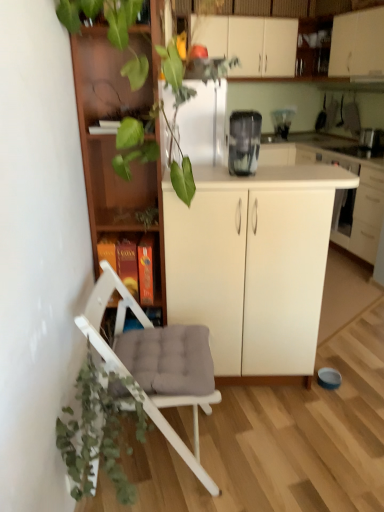
This screenshot has width=384, height=512. What do you see at coordinates (357, 44) in the screenshot? I see `white glossy cabinet at upper right, arranged as the second cabinetry when viewed from the left` at bounding box center [357, 44].

The image size is (384, 512). I want to click on transparent plastic blender at center, the first appliance ordered from the bottom, so click(244, 142).

The image size is (384, 512). What do you see at coordinates (282, 121) in the screenshot? I see `transparent plastic blender at upper center, which appears as the 2th appliance when viewed from the right` at bounding box center [282, 121].

The height and width of the screenshot is (512, 384). What do you see at coordinates (120, 115) in the screenshot? I see `green leafy plant at upper center` at bounding box center [120, 115].

The height and width of the screenshot is (512, 384). What are the coordinates of `white glossy cabinet at upper right, which is the third cabinetry in bottom-to-top order` in the screenshot? It's located at (357, 44).

From the picture: From a real-world perspective, which object rests below the other?

transparent plastic blender at center, the first appliance when ordered from front to back, from a real-world perspective.

Between white matte cabinet at upper center and transparent plastic blender at center, marked as the first appliance in a left-to-right arrangement, which one appears on the left side from the viewer's perspective?

From the viewer's perspective, transparent plastic blender at center, marked as the first appliance in a left-to-right arrangement, appears more on the left side.

Are white matte cabinet at upper center and transparent plastic blender at center, the third appliance when ordered from right to left, located far from each other?

Yes.

What's the angular difference between white matte cabinet at upper center and transparent plastic blender at center, the first appliance ordered from the bottom,'s facing directions?

There is a 76.2-degree angle between the facing directions of white matte cabinet at upper center and transparent plastic blender at center, the first appliance ordered from the bottom.

From the image's perspective, does transparent plastic blender at center, the first appliance when ordered from front to back, appear higher than white matte cabinet at upper center?

Incorrect, from the image's perspective, transparent plastic blender at center, the first appliance when ordered from front to back, is lower than white matte cabinet at upper center.

Is the depth of transparent plastic blender at center, the first appliance ordered from the bottom, greater than that of white matte cabinet at upper center?

No, transparent plastic blender at center, the first appliance ordered from the bottom, is closer to the camera.

Visually, is transparent plastic blender at center, the third appliance when ordered from right to left, positioned to the left or to the right of white matte cabinet at upper center?

transparent plastic blender at center, the third appliance when ordered from right to left, is positioned on white matte cabinet at upper center's left side.

Is wooden bookshelf at left not inside green matte plant at lower left?

That's correct, wooden bookshelf at left is outside of green matte plant at lower left.

Could you tell me if wooden bookshelf at left is turned towards green matte plant at lower left?

Yes, wooden bookshelf at left is aimed at green matte plant at lower left.

From the image's perspective, between wooden bookshelf at left and green matte plant at lower left, which one is located above?

wooden bookshelf at left is shown above in the image.

Does point (117, 294) appear closer or farther from the camera than point (77, 426)?

Point (117, 294) appears to be farther away from the viewer than point (77, 426).

Is transparent plastic blender at upper center, which appears as the 2th appliance when viewed from the left, wider or thinner than green leafy plant at upper center?

In the image, transparent plastic blender at upper center, which appears as the 2th appliance when viewed from the left, appears to be more narrow than green leafy plant at upper center.

Is point (277, 126) closer to camera compared to point (126, 133)?

That is False.

Is green leafy plant at upper center directly adjacent to white matte cabinet at center, the 3th cabinetry viewed from the top?

No, green leafy plant at upper center is not in contact with white matte cabinet at center, the 3th cabinetry viewed from the top.

Which point is more forward, (138, 192) or (242, 259)?

The point (242, 259) is more forward.

Does green leafy plant at upper center have a smaller size compared to white matte cabinet at center, the 1th cabinetry in the left-to-right sequence?

Yes.

In the scene shown: In terms of width, does green leafy plant at upper center look wider or thinner when compared to white matte cabinet at center, which is the first cabinetry from bottom to top?

In the image, green leafy plant at upper center appears to be wider than white matte cabinet at center, which is the first cabinetry from bottom to top.

From the image's perspective, is white glossy cabinet at upper right, which is the 1th cabinetry in top-to-bottom order, above or below white matte cabinet at center, the 3th cabinetry viewed from the top?

From the image's perspective, white glossy cabinet at upper right, which is the 1th cabinetry in top-to-bottom order, appears above white matte cabinet at center, the 3th cabinetry viewed from the top.

Considering the sizes of white glossy cabinet at upper right, arranged as the second cabinetry when viewed from the left, and white matte cabinet at center, the 3th cabinetry viewed from the top, in the image, is white glossy cabinet at upper right, arranged as the second cabinetry when viewed from the left, taller or shorter than white matte cabinet at center, the 3th cabinetry viewed from the top,?

Clearly, white glossy cabinet at upper right, arranged as the second cabinetry when viewed from the left, is shorter compared to white matte cabinet at center, the 3th cabinetry viewed from the top.

Which object is closer to the camera, white glossy cabinet at upper right, which appears as the 2th cabinetry when viewed from the right, or white matte cabinet at center, the 3th cabinetry when ordered from right to left?

Positioned in front is white matte cabinet at center, the 3th cabinetry when ordered from right to left.

Is white glossy cabinet at upper right, which appears as the 2th cabinetry when viewed from the right, positioned with its back to white matte cabinet at center, the 1th cabinetry in the left-to-right sequence?

No, white glossy cabinet at upper right, which appears as the 2th cabinetry when viewed from the right, is not facing the opposite direction of white matte cabinet at center, the 1th cabinetry in the left-to-right sequence.

In the scene shown: From the image's perspective, is white matte cabinet at upper center beneath white matte cabinet at center, marked as the second cabinetry in a top-to-bottom arrangement?

Actually, white matte cabinet at upper center appears above white matte cabinet at center, marked as the second cabinetry in a top-to-bottom arrangement, in the image.

Is white matte cabinet at upper center touching white matte cabinet at center, which is the second cabinetry in bottom-to-top order?

No, white matte cabinet at upper center is not in contact with white matte cabinet at center, which is the second cabinetry in bottom-to-top order.

From a real-world perspective, between white matte cabinet at upper center and white matte cabinet at center, the 1th cabinetry when ordered from right to left, who is vertically higher?

white matte cabinet at upper center, from a real-world perspective.

Considering the positions of objects white matte cabinet at upper center and white matte cabinet at center, marked as the second cabinetry in a top-to-bottom arrangement, in the image provided, who is in front, white matte cabinet at upper center or white matte cabinet at center, marked as the second cabinetry in a top-to-bottom arrangement,?

white matte cabinet at center, marked as the second cabinetry in a top-to-bottom arrangement, is closer to the camera.

In order to click on dresser behind the transparent plastic blender at center, the third appliance when ordered from right to left in this screenshot , I will do `click(261, 34)`.

This screenshot has height=512, width=384. In order to click on appliance on the left of the white matte cabinet at upper center in this screenshot , I will do `click(244, 142)`.

From the image, which object appears to be farther from transparent plastic blender at center, which is counted as the third appliance, starting from the top, wooden bookshelf at left or transparent plastic blender at upper center, which appears as the 2th appliance when viewed from the left?

transparent plastic blender at upper center, which appears as the 2th appliance when viewed from the left, lies further to transparent plastic blender at center, which is counted as the third appliance, starting from the top, than the other object.

From the picture: From the image, which object appears to be nearer to metallic silver toaster at upper right, the 2th appliance when ordered from back to front, green leafy plant at upper center or green matte plant at lower left?

Based on the image, green leafy plant at upper center appears to be nearer to metallic silver toaster at upper right, the 2th appliance when ordered from back to front.

Considering their positions, is transparent plastic blender at center, which is the third appliance from back to front, positioned further to green matte plant at lower left than white matte cabinet at upper center?

white matte cabinet at upper center is positioned further to the anchor green matte plant at lower left.

From the image, which object appears to be farther from green leafy plant at upper center, metallic silver toaster at upper right, positioned as the 2th appliance in front-to-back order, or transparent plastic blender at center, which is counted as the third appliance, starting from the top?

metallic silver toaster at upper right, positioned as the 2th appliance in front-to-back order, is positioned further to the anchor green leafy plant at upper center.

When comparing their distances from white glossy cabinet at upper right, which is the 1th cabinetry in top-to-bottom order, does green matte plant at lower left or white matte cabinet at upper center seem closer?

Among the two, white matte cabinet at upper center is located nearer to white glossy cabinet at upper right, which is the 1th cabinetry in top-to-bottom order.

When comparing their distances from white matte cabinet at upper center, does white glossy cabinet at upper right, which appears as the 2th cabinetry when viewed from the right, or wooden bookshelf at left seem further?

wooden bookshelf at left lies further to white matte cabinet at upper center than the other object.

Considering their positions, is white matte cabinet at upper center positioned further to green leafy plant at upper center than metallic silver toaster at upper right, the 1th appliance in the right-to-left sequence?

metallic silver toaster at upper right, the 1th appliance in the right-to-left sequence.

Which object lies further to the anchor point transparent plastic blender at center, the first appliance when ordered from front to back, wooden bookshelf at left or green matte plant at lower left?

green matte plant at lower left is further to transparent plastic blender at center, the first appliance when ordered from front to back.

Identify the location of shelf located between green leafy plant at upper center and white matte cabinet at upper center in the depth direction. click(133, 261).

Find the location of a particular element. The width and height of the screenshot is (384, 512). shelf located between green leafy plant at upper center and transparent plastic blender at upper center, positioned as the 3th appliance in bottom-to-top order, in the depth direction is located at coordinates (133, 261).

Identify the location of appliance between green leafy plant at upper center and white padded chair at lower left vertically. The width and height of the screenshot is (384, 512). (244, 142).

Identify the location of dresser between green matte plant at lower left and transparent plastic blender at upper center, which appears as the 2th appliance when viewed from the left, in the front-back direction. (261, 34).